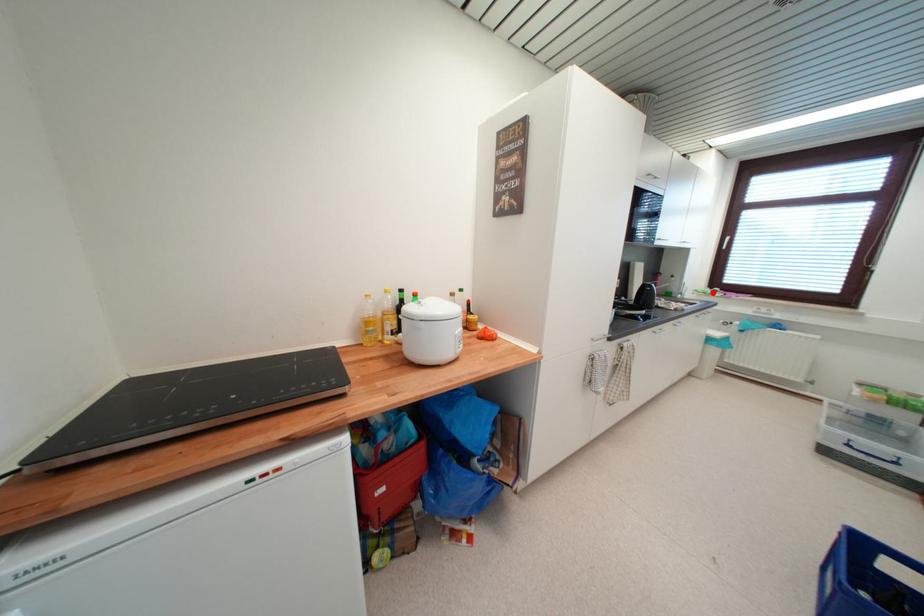
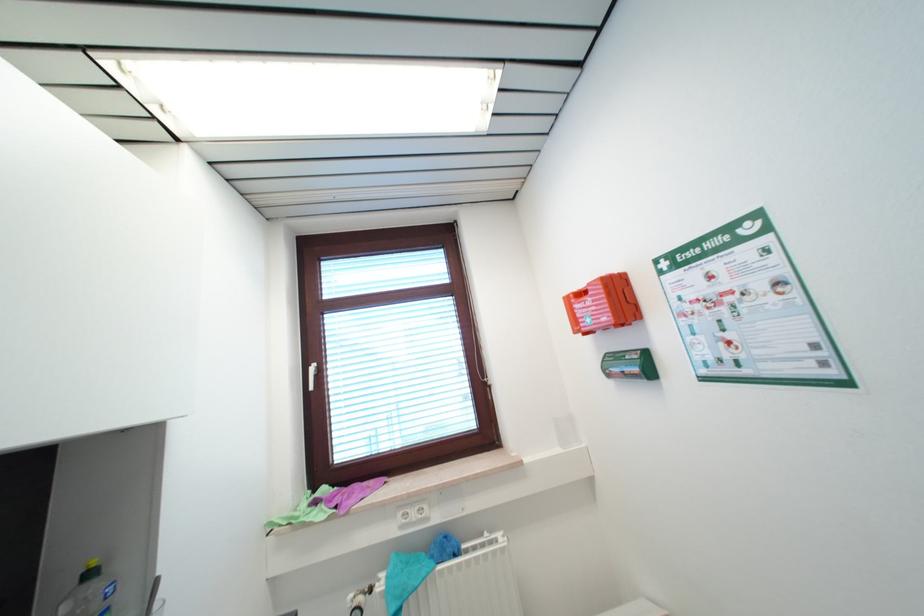
The point at the highlighted location is marked in the first image. Where is the corresponding point in the second image?

(311, 501)